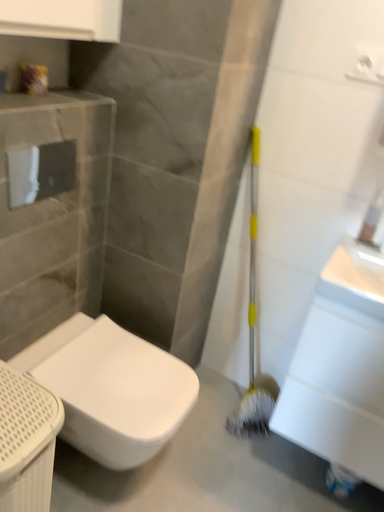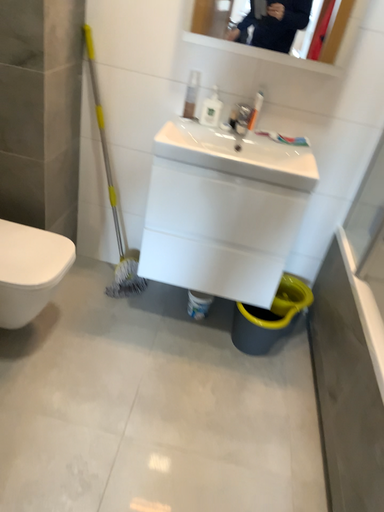
Question: How did the camera likely rotate when shooting the video?

Choices:
 (A) rotated downward
 (B) rotated upward

Answer: (A)